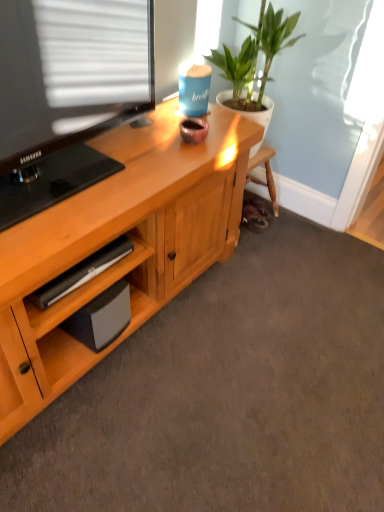
Question: Is point (294, 16) closer or farther from the camera than point (114, 320)?

Choices:
 (A) farther
 (B) closer

Answer: (A)

Question: From the image's perspective, relative to black matte speaker at lower left, is green leafy plant at upper right above or below?

Choices:
 (A) below
 (B) above

Answer: (B)

Question: From a real-world perspective, is green leafy plant at upper right physically located above or below black matte speaker at lower left?

Choices:
 (A) above
 (B) below

Answer: (A)

Question: Is point (124, 292) closer or farther from the camera than point (231, 76)?

Choices:
 (A) closer
 (B) farther

Answer: (A)

Question: From a real-world perspective, is black matte speaker at lower left physically located above or below green leafy plant at upper right?

Choices:
 (A) below
 (B) above

Answer: (A)

Question: Which is correct: black matte speaker at lower left is inside green leafy plant at upper right, or outside of it?

Choices:
 (A) inside
 (B) outside

Answer: (B)

Question: From the image's perspective, relative to green leafy plant at upper right, is black matte speaker at lower left above or below?

Choices:
 (A) above
 (B) below

Answer: (B)